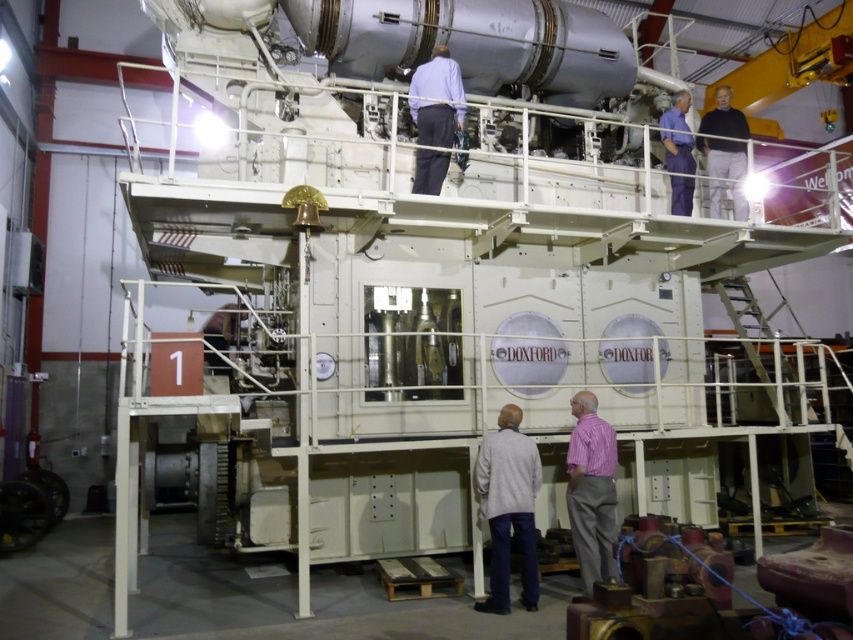
Between point (529, 458) and point (456, 116), which one is positioned in front?

Point (529, 458) is more forward.

Does point (518, 484) lie behind point (416, 182)?

No, it is not.

You are a GUI agent. You are given a task and a screenshot of the screen. Output one action in this format:
    pyautogui.click(x=<x>, y=<y>)
    Task: Click on the gray cotton shirt at lower center
    The image size is (853, 640).
    Given the screenshot: What is the action you would take?
    pyautogui.click(x=508, y=508)

Is point (454, 125) closer to viewer compared to point (686, 109)?

Yes.

Between light blue shirt at upper center and blue fabric shirt at upper center, which one appears on the right side from the viewer's perspective?

blue fabric shirt at upper center

This screenshot has height=640, width=853. Find the location of `light blue shirt at upper center`. light blue shirt at upper center is located at coordinates pos(436,99).

Does gray cotton shirt at lower center have a lesser height compared to matte blue shirt at upper center?

Yes, gray cotton shirt at lower center is shorter than matte blue shirt at upper center.

Is gray cotton shirt at lower center smaller than matte blue shirt at upper center?

Yes, gray cotton shirt at lower center is smaller than matte blue shirt at upper center.

Between point (532, 500) and point (680, 106), which one is positioned in front?

Point (532, 500) is more forward.

Find the location of a particular element. This screenshot has width=853, height=640. gray cotton shirt at lower center is located at coordinates (508, 508).